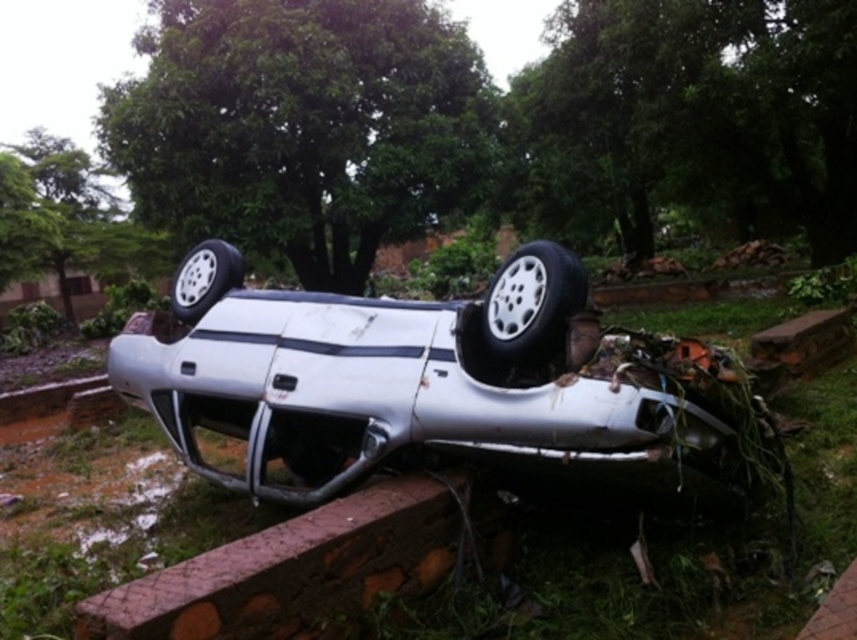
In the scene shown: You are a surveyor trying to map the scene of an accident. You have a coordinate system where the bottom left corner is the origin point. Where is the brown textured curb at lower center located in this coordinate system?

The brown textured curb at lower center is located at point (291, 570) in the coordinate system.

In the scene shown: You are a tow truck operator who needs to lift the damaged car from the brick wall. The brown textured curb at lower center and the white rubber tire at center are in your path. Which object should you move first to create space for the operation?

The white rubber tire at center should be moved first because the brown textured curb at lower center is larger and harder to move, making it more efficient to remove the smaller obstacle first.